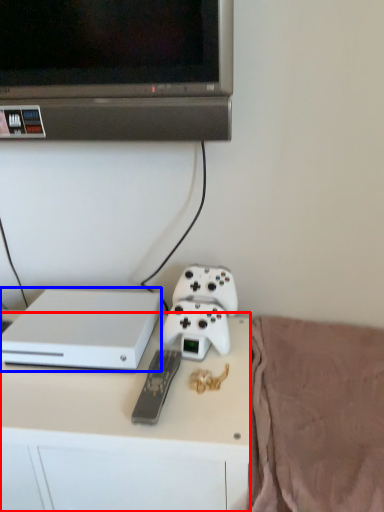
Question: Which object is closer to the camera taking this photo, desk (highlighted by a red box) or computer (highlighted by a blue box)?

Choices:
 (A) desk
 (B) computer

Answer: (A)